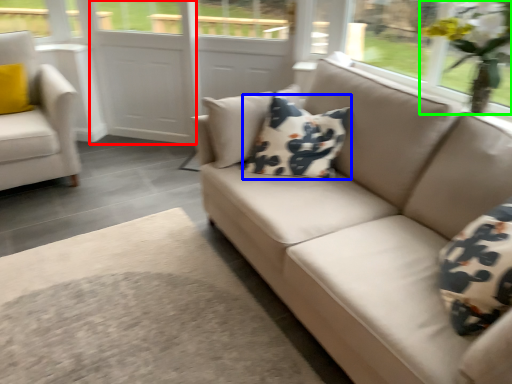
Question: Which is nearer to the screen door (highlighted by a red box)? pillow (highlighted by a blue box) or floral arrangement (highlighted by a green box).

Choices:
 (A) pillow
 (B) floral arrangement

Answer: (A)